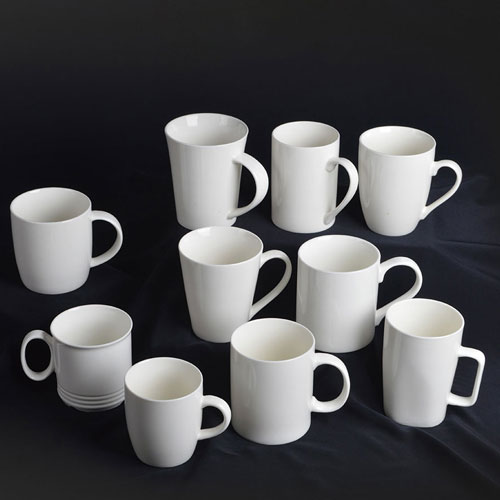
In order to click on white cups in this screenshot , I will do `click(52, 257)`, `click(82, 368)`, `click(171, 424)`, `click(273, 386)`, `click(226, 282)`, `click(214, 178)`, `click(301, 170)`, `click(339, 298)`, `click(393, 181)`, `click(419, 372)`.